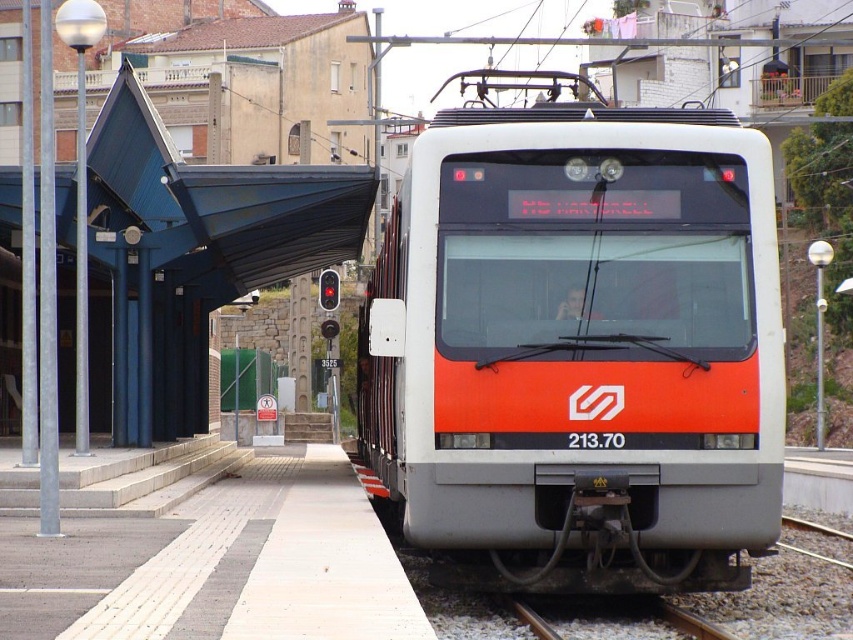
From the picture: You are a maintenance worker needing to move a 2.5 meter wide equipment cart across the platform. The orange glossy train at center is parked on the brown gravel train track at lower center. Can you safely move the cart around the train without crossing the track?

The orange glossy train at center is wider than the brown gravel train track at lower center. Since the cart is 2.5 meters wide, it can be maneuvered around the train on the platform area outside the track, as the train itself is wider than the track, providing space on either side.

You are standing at the platform and want to board the orange glossy train at center. If the platform is 10 meters long and the train is 8 meters long, can you board the train from your current position at the front end of the platform?

The orange glossy train at center is located at point coordinates which would require checking the distance from the front end of the platform. Since the platform is 10 meters and the train is 8 meters, if the train is centered, it would extend 4 meters from the center. The front of the platform is 0 meters, so the train starts at 0.541 meters from the front? Not sure. Maybe need more info. Hmm, perhaps the coordinates are normalized between 0 and 1. If so, 0.541 in x would be 5.41 meters from the left? Not

You are standing at the platform of the FGC train station. You see a point marked at coordinates (577, 346). What object is located at that point?

The point at coordinates (577, 346) marks the orange glossy train at center.